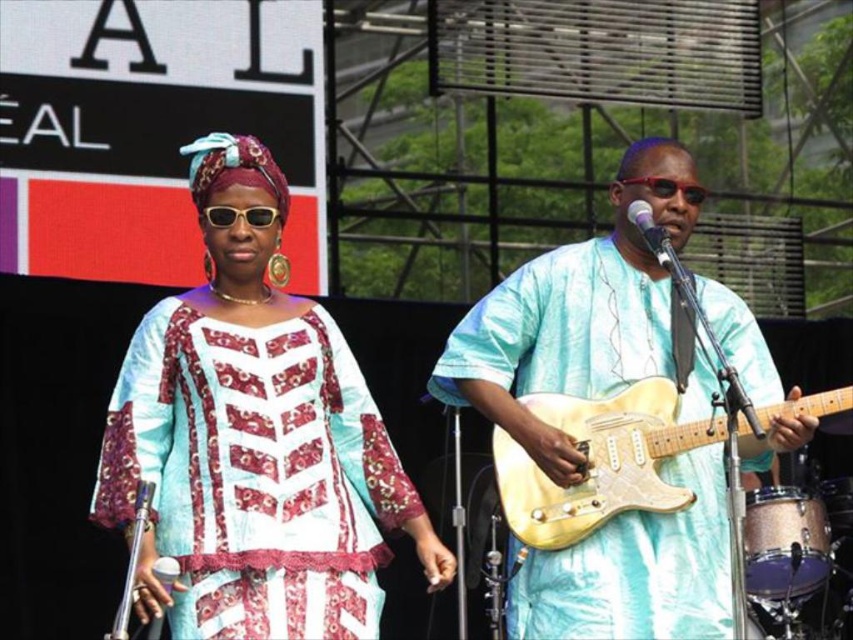
You are a stagehand preparing to adjust the lighting for the performance. The spotlight needs to cover both the matte teal and burgundy fabric dress at center and the light yellow wood guitar at center. Given that the spotlight has a maximum coverage radius of 5 meters, will it be able to illuminate both objects simultaneously?

The matte teal and burgundy fabric dress at center is 4.93 meters away from the light yellow wood guitar at center. Since the distance between them is less than the spotlight coverage radius of 5 meters, the spotlight can illuminate both objects simultaneously.

You are a stagehand setting up equipment for a performance. You have a light yellow wood guitar at center and a gold metallic drum at lower right. Which one requires more horizontal space to place on the stage?

The light yellow wood guitar at center might be wider than the gold metallic drum at lower right, so it likely requires more horizontal space.

You are a photographer setting up for a live performance. You need to ensure that the matte teal and burgundy fabric dress at center and the gold metallic drum at lower right are both visible in your shot. Given their sizes, which object should you prioritize positioning closer to the camera to maintain clarity?

The matte teal and burgundy fabric dress at center is smaller than the gold metallic drum at lower right, so you should position the matte teal and burgundy fabric dress at center closer to the camera to ensure it appears clear and detailed in the photograph.